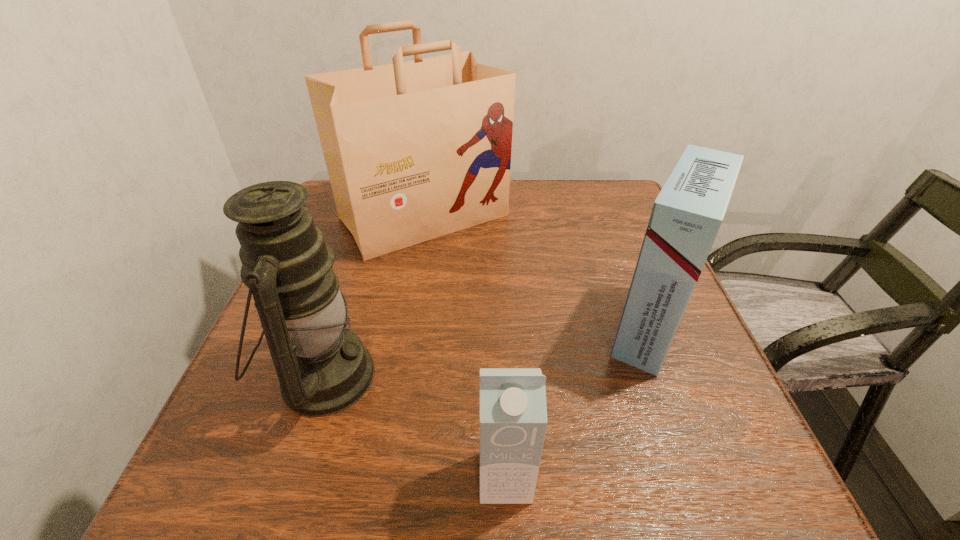
Locate an element on the screen. The image size is (960, 540). grocery bag that is at the left edge is located at coordinates (416, 150).

Where is `oil lamp at the left edge`? oil lamp at the left edge is located at coordinates (323, 368).

Find the location of a particular element. This screenshot has height=540, width=960. object that is at the right edge is located at coordinates (686, 216).

Image resolution: width=960 pixels, height=540 pixels. In order to click on object at the far left corner in this screenshot , I will do `click(416, 150)`.

The width and height of the screenshot is (960, 540). I want to click on free space at the left edge, so click(x=217, y=432).

Locate an element on the screen. vacant area at the right edge is located at coordinates [x=685, y=320].

Identify the location of free region at the near left corner of the desktop. (219, 511).

Find the location of a particular element. The width and height of the screenshot is (960, 540). vacant space at the far right corner of the desktop is located at coordinates (578, 180).

The width and height of the screenshot is (960, 540). In order to click on vacant space at the near right corner of the desktop in this screenshot , I will do `click(689, 493)`.

Find the location of `free space between the oil lamp and the rightmost object`. free space between the oil lamp and the rightmost object is located at coordinates (487, 352).